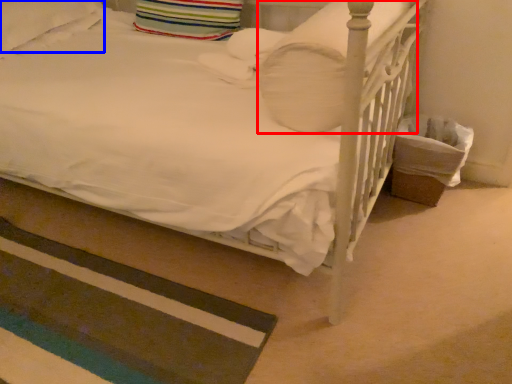
Question: Which point is closer to the camera, pillow (highlighted by a red box) or pillow (highlighted by a blue box)?

Choices:
 (A) pillow
 (B) pillow

Answer: (A)